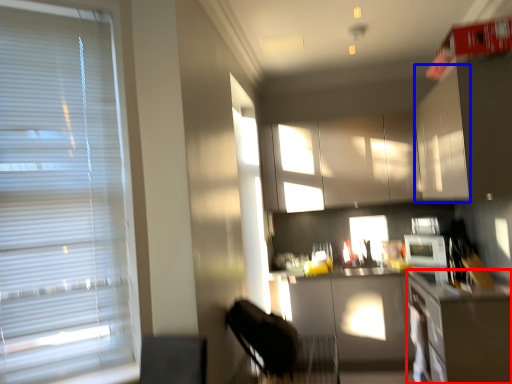
Question: Among these objects, which one is farthest to the camera, counter top (highlighted by a red box) or cabinetry (highlighted by a blue box)?

Choices:
 (A) counter top
 (B) cabinetry

Answer: (B)